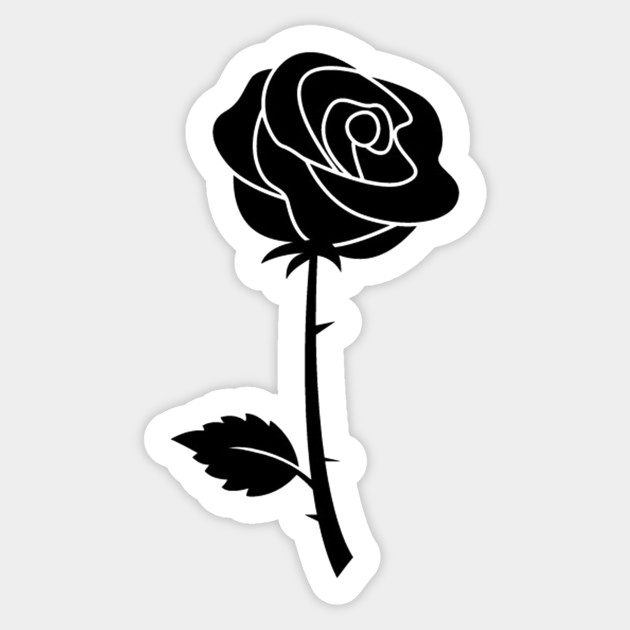
In order to click on decal in this screenshot , I will do `click(305, 290)`.